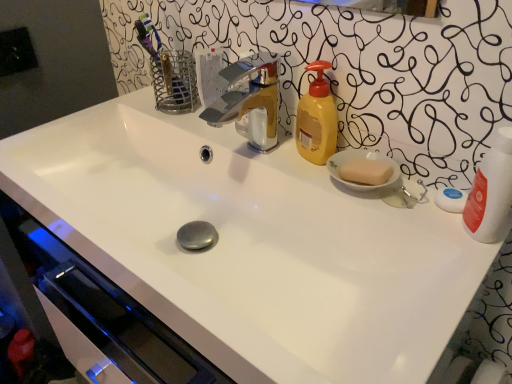
Question: Is yellow matte soap dispenser at upper right positioned in front of polished chrome faucet at center?

Choices:
 (A) no
 (B) yes

Answer: (A)

Question: Is yellow matte soap dispenser at upper right bigger than polished chrome faucet at center?

Choices:
 (A) no
 (B) yes

Answer: (A)

Question: From a real-world perspective, is yellow matte soap dispenser at upper right below polished chrome faucet at center?

Choices:
 (A) no
 (B) yes

Answer: (B)

Question: Could polished chrome faucet at center be considered to be inside yellow matte soap dispenser at upper right?

Choices:
 (A) yes
 (B) no

Answer: (B)

Question: Is yellow matte soap dispenser at upper right to the left of polished chrome faucet at center from the viewer's perspective?

Choices:
 (A) no
 (B) yes

Answer: (A)

Question: From the image's perspective, is polished chrome faucet at center above or below yellow matte soap dispenser at upper right?

Choices:
 (A) below
 (B) above

Answer: (A)

Question: In terms of width, does polished chrome faucet at center look wider or thinner when compared to yellow matte soap dispenser at upper right?

Choices:
 (A) wide
 (B) thin

Answer: (A)

Question: Based on their positions, is polished chrome faucet at center located to the left or right of yellow matte soap dispenser at upper right?

Choices:
 (A) left
 (B) right

Answer: (A)

Question: Is point click(x=266, y=147) positioned closer to the camera than point click(x=330, y=140)?

Choices:
 (A) farther
 (B) closer

Answer: (A)

Question: Looking at the image, does yellow matte soap dispenser at upper right seem bigger or smaller compared to polished chrome faucet at center?

Choices:
 (A) big
 (B) small

Answer: (B)

Question: Is yellow matte soap dispenser at upper right in front of or behind polished chrome faucet at center in the image?

Choices:
 (A) behind
 (B) front

Answer: (A)

Question: Choose the correct answer: Is yellow matte soap dispenser at upper right inside polished chrome faucet at center or outside it?

Choices:
 (A) inside
 (B) outside

Answer: (B)

Question: From a real-world perspective, is yellow matte soap dispenser at upper right physically located above or below polished chrome faucet at center?

Choices:
 (A) below
 (B) above

Answer: (A)

Question: Is point (236, 82) positioned closer to the camera than point (501, 130)?

Choices:
 (A) closer
 (B) farther

Answer: (B)

Question: In terms of size, does polished chrome faucet at center appear bigger or smaller than white glossy bottle at right?

Choices:
 (A) big
 (B) small

Answer: (B)